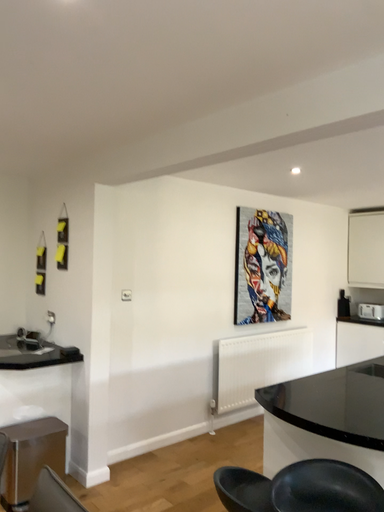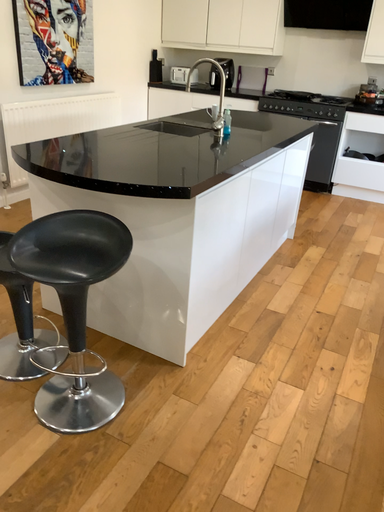
Question: How did the camera likely rotate when shooting the video?

Choices:
 (A) rotated right
 (B) rotated left

Answer: (A)